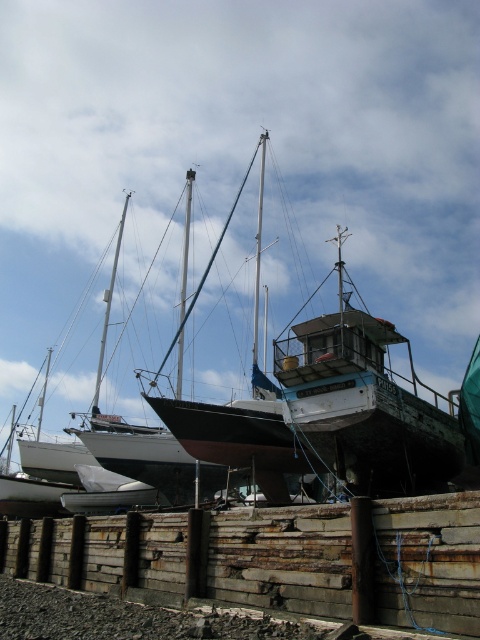
You are standing at the edge of the marina and want to walk to the rusty wood dock at lower center. Which direction should you head towards?

You should head towards the lower center direction to reach the rusty wood dock at lower center.